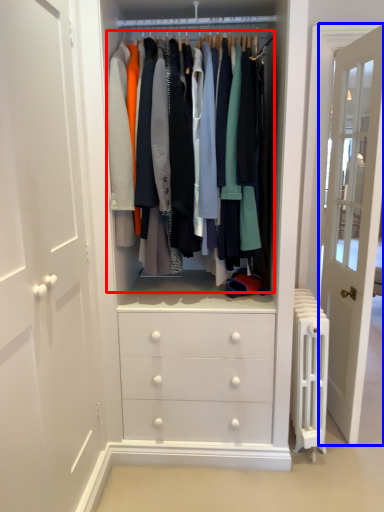
Question: Which point is further to the camera, closet (highlighted by a red box) or door (highlighted by a blue box)?

Choices:
 (A) closet
 (B) door

Answer: (B)